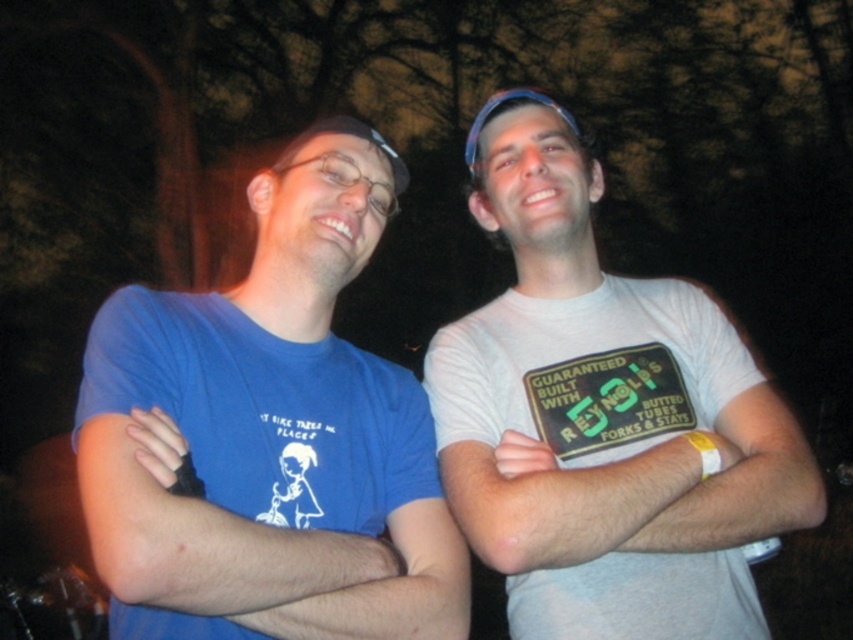
Does matte blue t-shirt at left appear on the right side of white cotton t-shirt at center?

No, matte blue t-shirt at left is not to the right of white cotton t-shirt at center.

Which is more to the right, matte blue t-shirt at left or white cotton t-shirt at center?

Answer: Positioned to the right is white cotton t-shirt at center.

Does point (253, 566) lie in front of point (676, 392)?

Yes.

Image resolution: width=853 pixels, height=640 pixels. Identify the location of matte blue t-shirt at left. (271, 435).